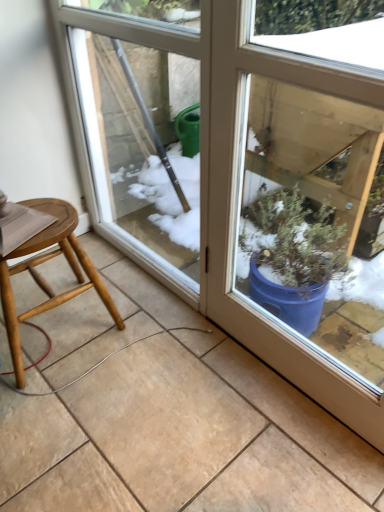
Where is `free region under light wood stool at lower left (from a real-world perspective)`? This screenshot has height=512, width=384. free region under light wood stool at lower left (from a real-world perspective) is located at coordinates (62, 330).